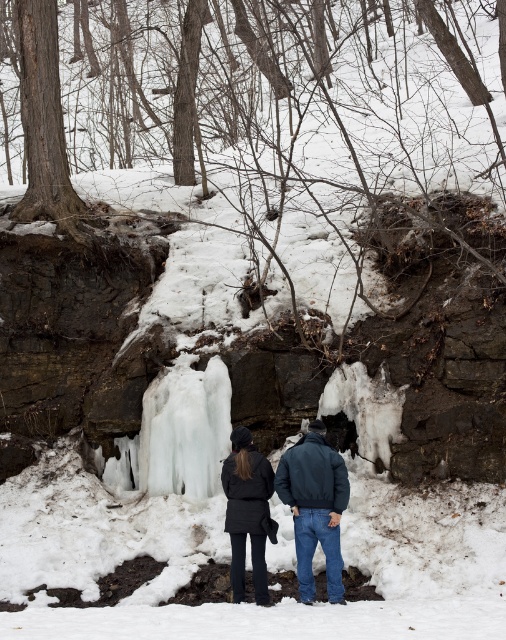
Question: Can you confirm if icy translucent waterfall at center is positioned above dark blue jacket at center?

Choices:
 (A) yes
 (B) no

Answer: (A)

Question: Which of the following is the farthest from the observer?

Choices:
 (A) dark blue jacket at center
 (B) dark gray matte jacket at center
 (C) icy translucent waterfall at center

Answer: (C)

Question: Is dark blue jacket at center to the right of dark gray matte jacket at center from the viewer's perspective?

Choices:
 (A) yes
 (B) no

Answer: (A)

Question: Estimate the real-world distances between objects in this image. Which object is farther from the icy translucent waterfall at center?

Choices:
 (A) dark gray matte jacket at center
 (B) dark blue jacket at center

Answer: (B)

Question: Does dark blue jacket at center lie in front of dark gray matte jacket at center?

Choices:
 (A) no
 (B) yes

Answer: (B)

Question: Among these points, which one is farthest from the camera?

Choices:
 (A) (239, 595)
 (B) (190, 442)
 (C) (251, 496)

Answer: (B)